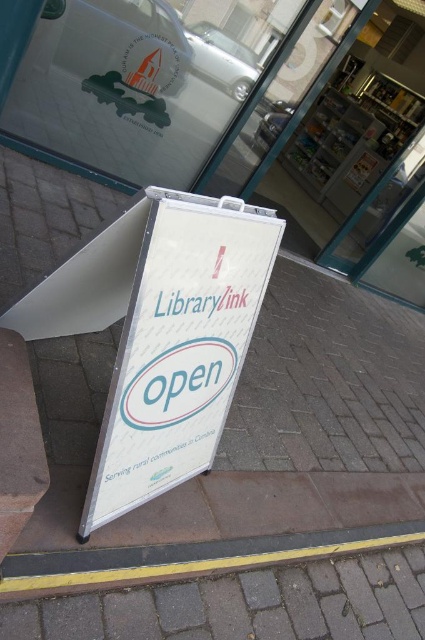
Question: In this image, where is white plastic sign at center located relative to yellow rubber at lower center?

Choices:
 (A) left
 (B) right

Answer: (A)

Question: Which object appears farthest from the camera in this image?

Choices:
 (A) yellow rubber at lower center
 (B) white plastic sign at center

Answer: (A)

Question: Considering the relative positions of white plastic sign at center and yellow rubber at lower center in the image provided, where is white plastic sign at center located with respect to yellow rubber at lower center?

Choices:
 (A) right
 (B) left

Answer: (B)

Question: Among these objects, which one is nearest to the camera?

Choices:
 (A) white plastic sign at center
 (B) yellow rubber at lower center

Answer: (A)

Question: Is white plastic sign at center wider than yellow rubber at lower center?

Choices:
 (A) yes
 (B) no

Answer: (B)